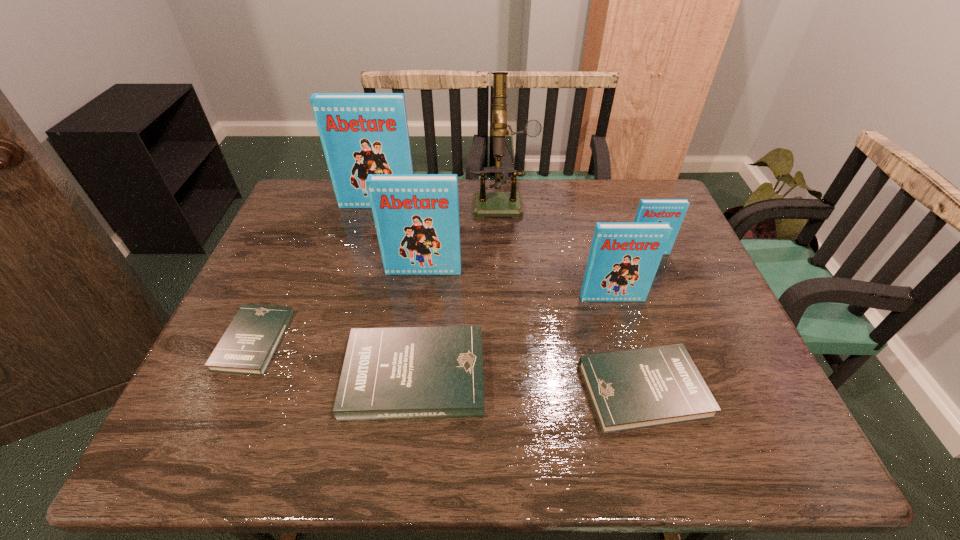
The height and width of the screenshot is (540, 960). Identify the location of microscope. (485, 204).

Locate an element on the screen. The height and width of the screenshot is (540, 960). the farthest book is located at coordinates (361, 133).

I want to click on the biggest blue book, so click(x=361, y=133).

I want to click on the third farthest blue book, so click(x=416, y=216).

Find the location of `the second biggest blue book`. the second biggest blue book is located at coordinates click(416, 216).

I want to click on the fifth shortest object, so click(x=624, y=257).

Locate an element on the screen. the nearest blue book is located at coordinates (624, 257).

The height and width of the screenshot is (540, 960). Find the location of `the second farthest book`. the second farthest book is located at coordinates (673, 211).

Locate an element on the screen. This screenshot has height=540, width=960. the sixth nearest object is located at coordinates (673, 211).

You are a GUI agent. You are given a task and a screenshot of the screen. Output one action in this format:
    pyautogui.click(x=<x>, y=<y>)
    Task: Click on the biggest dark book
    
    Given the screenshot: What is the action you would take?
    pyautogui.click(x=401, y=373)